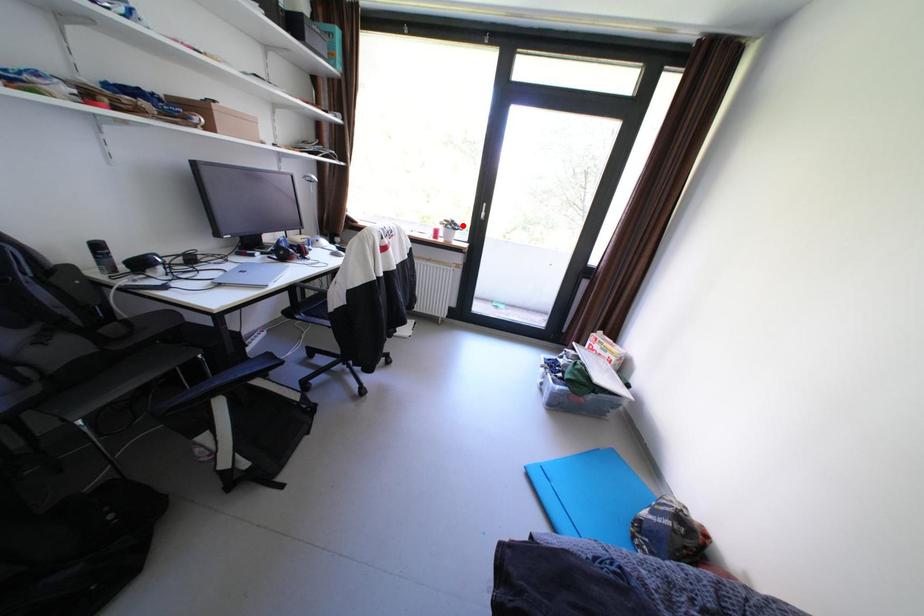
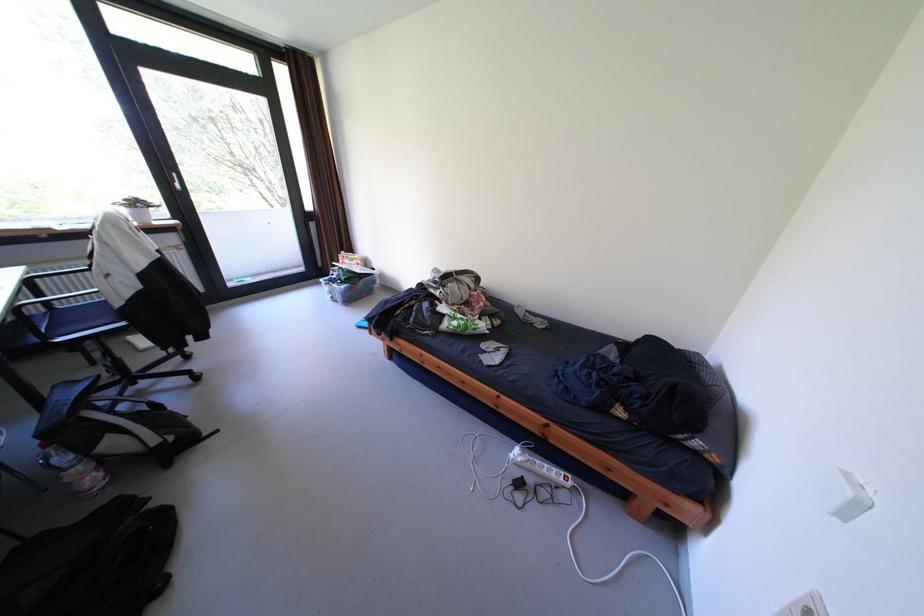
Find the pixel in the second image that matches the highlighted location in the first image.

(149, 205)